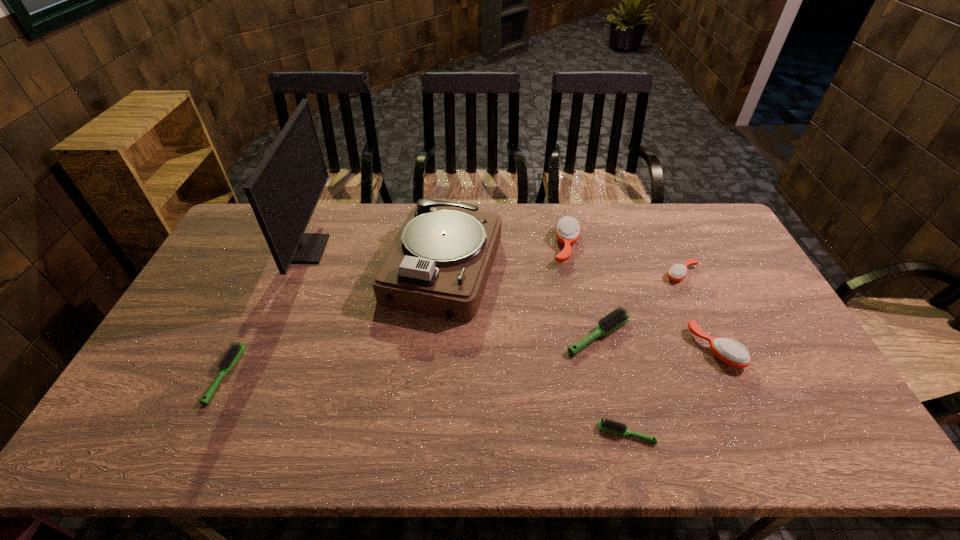
Where is `the tallest object`? The width and height of the screenshot is (960, 540). the tallest object is located at coordinates (283, 191).

This screenshot has height=540, width=960. I want to click on the seventh shortest object, so click(x=439, y=263).

Find the location of `the sixth object from right to left`. the sixth object from right to left is located at coordinates (439, 263).

This screenshot has width=960, height=540. I want to click on the leftmost orange hairbrush, so [x=567, y=230].

Identify the location of the sixth shortest object. (567, 230).

This screenshot has height=540, width=960. Find the location of `the fourth tallest object`. the fourth tallest object is located at coordinates (728, 351).

Identify the location of the second biggest orange hairbrush. Image resolution: width=960 pixels, height=540 pixels. (728, 351).

At what (x,y) coordinates should I click in order to perform the action: click on the biggest light hairbrush. Please return your answer as a coordinate pair (x, y). Looking at the image, I should click on (615, 319).

Image resolution: width=960 pixels, height=540 pixels. I want to click on the smallest orange hairbrush, so click(677, 272).

Where is `the second shortest hairbrush`? the second shortest hairbrush is located at coordinates (233, 353).